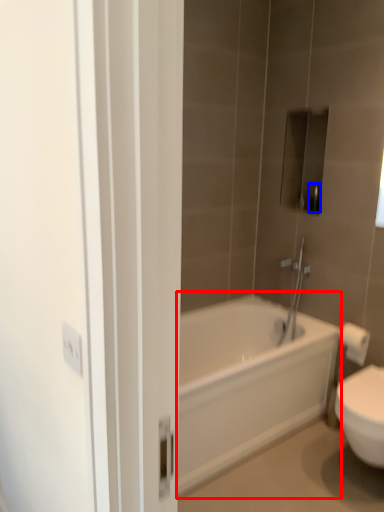
Question: Which point is closer to the camera, bathtub (highlighted by a red box) or toiletry (highlighted by a blue box)?

Choices:
 (A) bathtub
 (B) toiletry

Answer: (A)